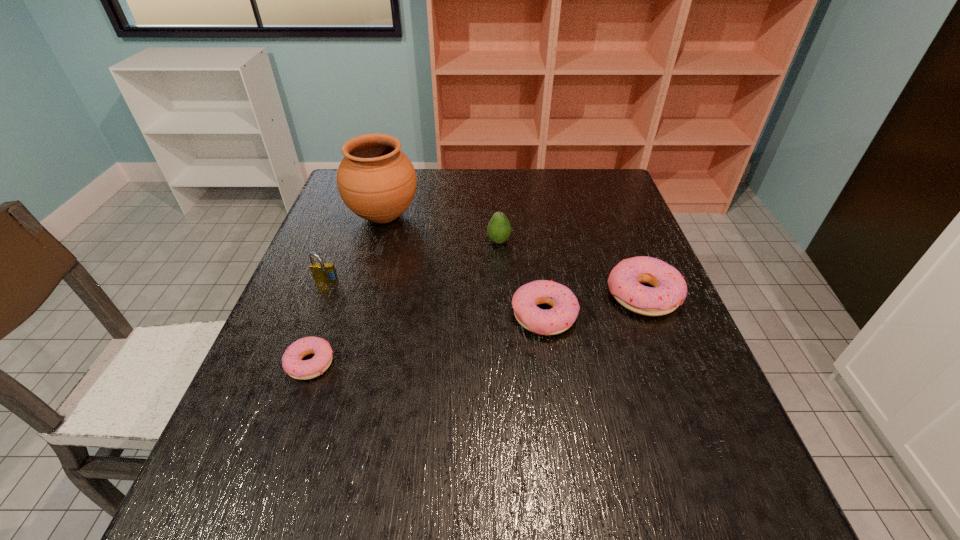
Find the location of a particular element. The height and width of the screenshot is (540, 960). vacant point that satisfies the following two spatial constraints: 1. on the front side of the tallest object; 2. on the left side of the avocado is located at coordinates (376, 241).

You are a GUI agent. You are given a task and a screenshot of the screen. Output one action in this format:
    pyautogui.click(x=<x>, y=<y>)
    Task: Click on the vacant position in the image that satisfies the following two spatial constraints: 1. on the side with the combination dials of the leftmost doughnut; 2. on the right side of the padlock
    
    Given the screenshot: What is the action you would take?
    pyautogui.click(x=295, y=363)

Where is `vacant area in the image that satisfies the following two spatial constraints: 1. on the back side of the avocado; 2. on the right side of the shortest doughnut`? This screenshot has width=960, height=540. vacant area in the image that satisfies the following two spatial constraints: 1. on the back side of the avocado; 2. on the right side of the shortest doughnut is located at coordinates click(353, 241).

Locate an element on the screen. vacant space that satisfies the following two spatial constraints: 1. on the side with the combination dials of the padlock; 2. on the left side of the rightmost doughnut is located at coordinates 321,295.